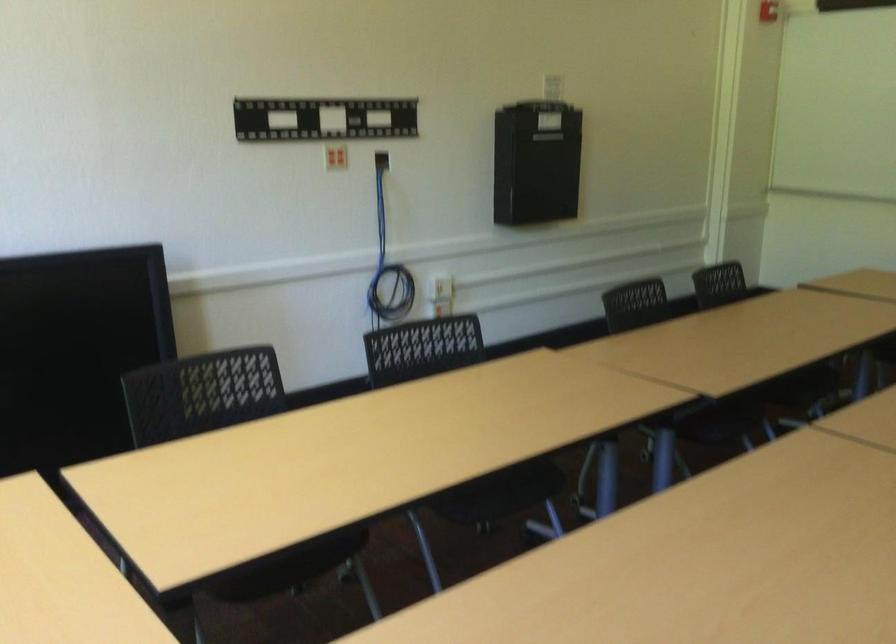
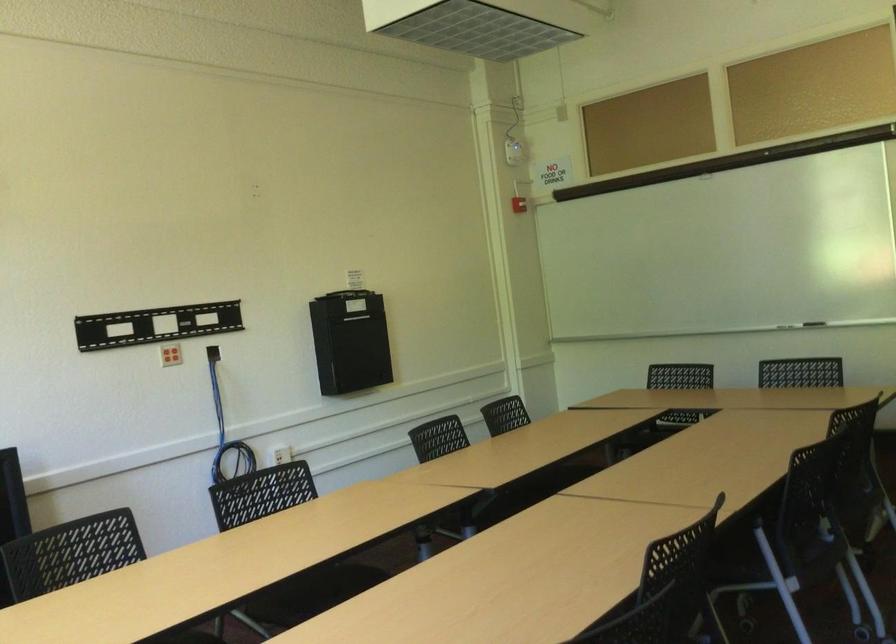
Question: In a continuous first-person perspective shot, in which direction is the camera moving?

Choices:
 (A) Left
 (B) Right
 (C) Forward
 (D) Backward

Answer: (D)